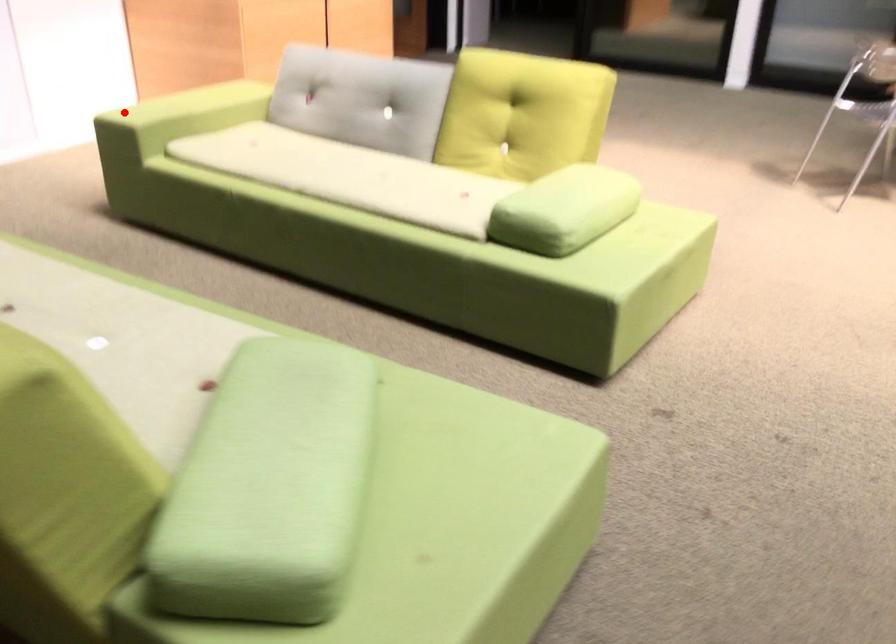
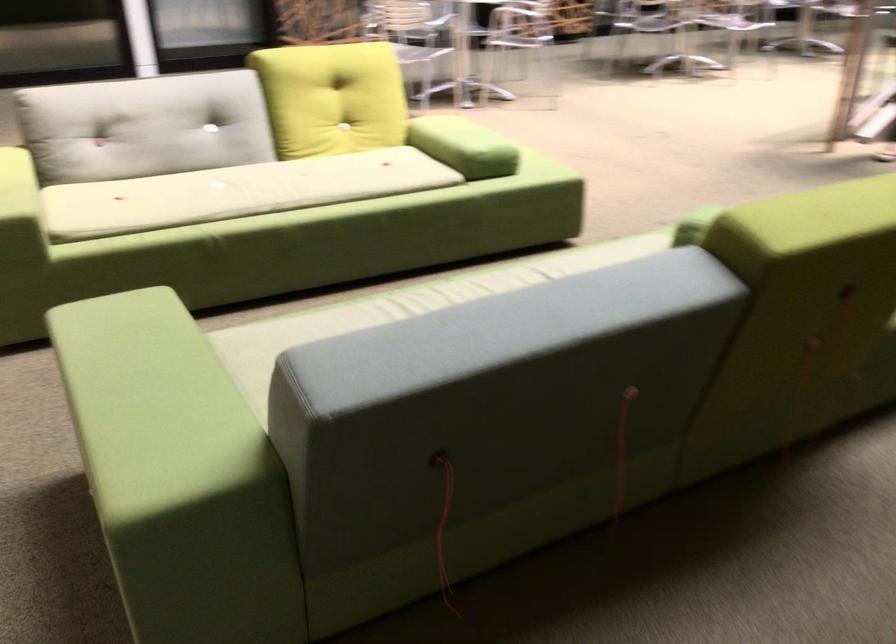
In the second image, find the point that corresponds to the highlighted location in the first image.

(19, 207)